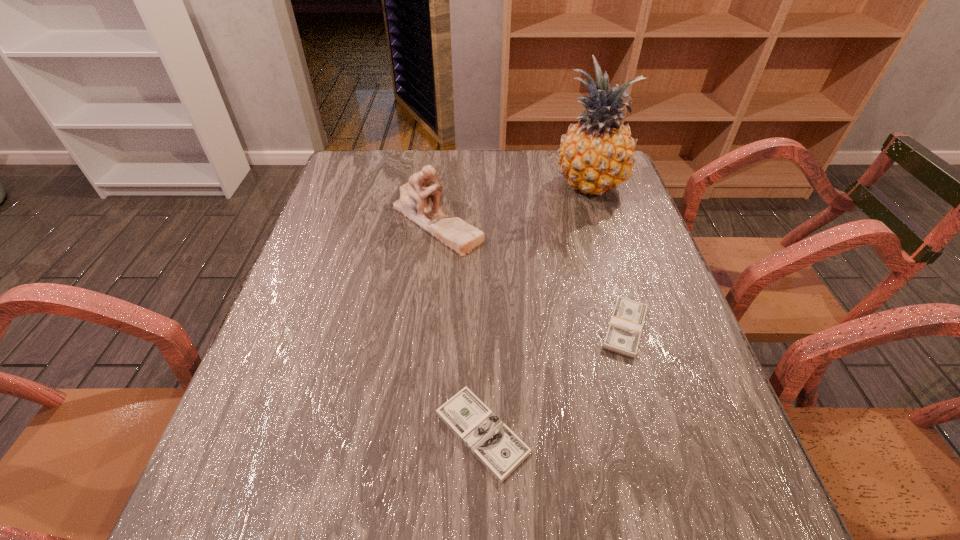
The height and width of the screenshot is (540, 960). In order to click on pineapple in this screenshot , I will do `click(596, 155)`.

This screenshot has height=540, width=960. In order to click on figurine in this screenshot , I will do `click(416, 197)`.

Where is `the farther dollar`? The image size is (960, 540). the farther dollar is located at coordinates (625, 327).

Image resolution: width=960 pixels, height=540 pixels. I want to click on the second shortest object, so click(625, 327).

At what (x,y) coordinates should I click in order to perform the action: click on the shorter dollar. Please return your answer as a coordinate pair (x, y). The image size is (960, 540). Looking at the image, I should click on (493, 442).

Where is `the nearer dollar`? This screenshot has width=960, height=540. the nearer dollar is located at coordinates (493, 442).

At what (x,y) coordinates should I click in order to perform the action: click on free space located 0.280m on the left of the pineapple. Please return your answer as a coordinate pair (x, y). Looking at the image, I should click on (460, 186).

Locate an element on the screen. The image size is (960, 540). vacant region located 0.190m on the front-facing side of the figurine is located at coordinates (426, 315).

Image resolution: width=960 pixels, height=540 pixels. I want to click on free spot located on the back of the second nearest object, so click(600, 245).

Identify the location of vacant space located 0.280m on the right of the shortest object. This screenshot has width=960, height=540. (688, 433).